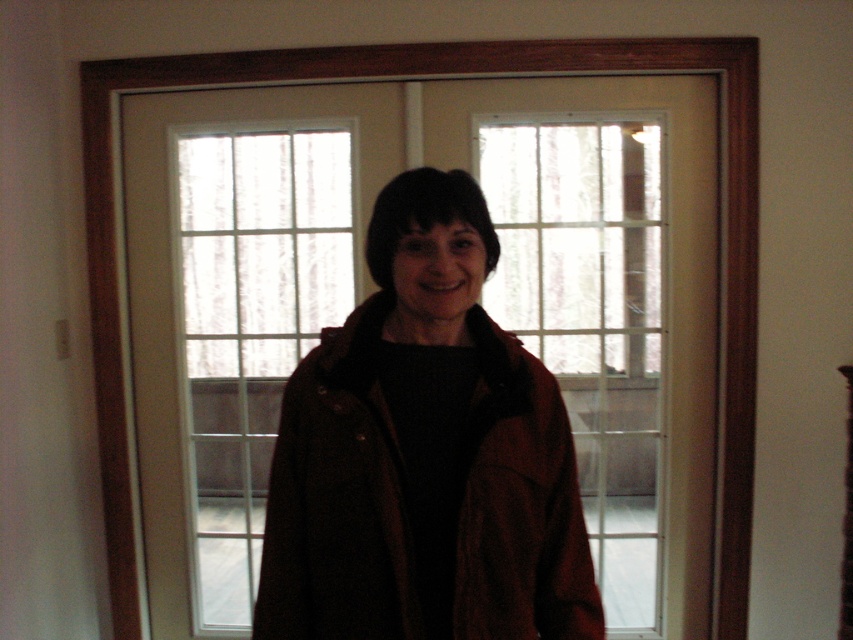
Is point (270, 564) farther from viewer compared to point (294, 240)?

That is False.

Is brown leather jacket at center bigger than clear glass window at center?

No.

Is point (485, 376) closer to camera compared to point (311, 225)?

Yes, it is.

This screenshot has width=853, height=640. Identify the location of brown leather jacket at center. (410, 504).